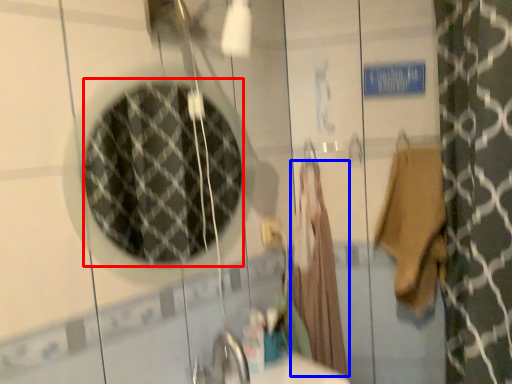
Question: Which object appears farthest to the camera in this image, mirror (highlighted by a red box) or robe (highlighted by a blue box)?

Choices:
 (A) mirror
 (B) robe

Answer: (B)